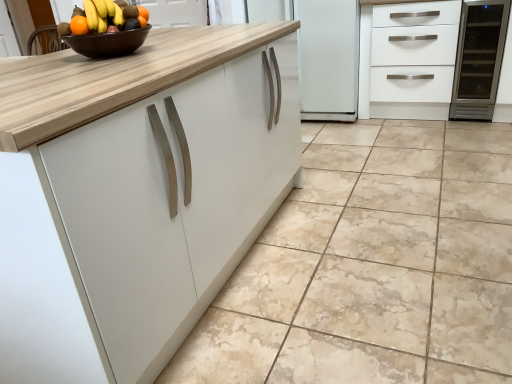
Question: Relative to brown glossy bowl at upper center, is orange matte grapefruit at upper left in front or behind?

Choices:
 (A) behind
 (B) front

Answer: (B)

Question: Do you think orange matte grapefruit at upper left is within brown glossy bowl at upper center, or outside of it?

Choices:
 (A) outside
 (B) inside

Answer: (A)

Question: Considering the real-world distances, which object is farthest from the satin stainless steel wine cooler at right?

Choices:
 (A) beige marble floor at center
 (B) orange matte grapefruit at upper left
 (C) brown glossy bowl at upper center
 (D) white matte cabinet at upper right

Answer: (C)

Question: Which is nearer to the satin stainless steel wine cooler at right?

Choices:
 (A) orange matte grapefruit at upper left
 (B) beige marble floor at center
 (C) brown glossy bowl at upper center
 (D) white matte cabinet at upper right

Answer: (D)